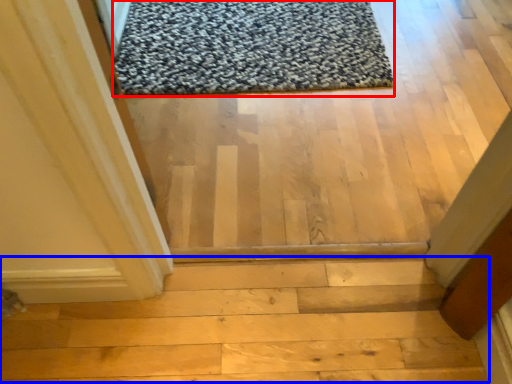
Question: Which object appears farthest to the camera in this image, mat (highlighted by a red box) or stairwell (highlighted by a blue box)?

Choices:
 (A) mat
 (B) stairwell

Answer: (A)